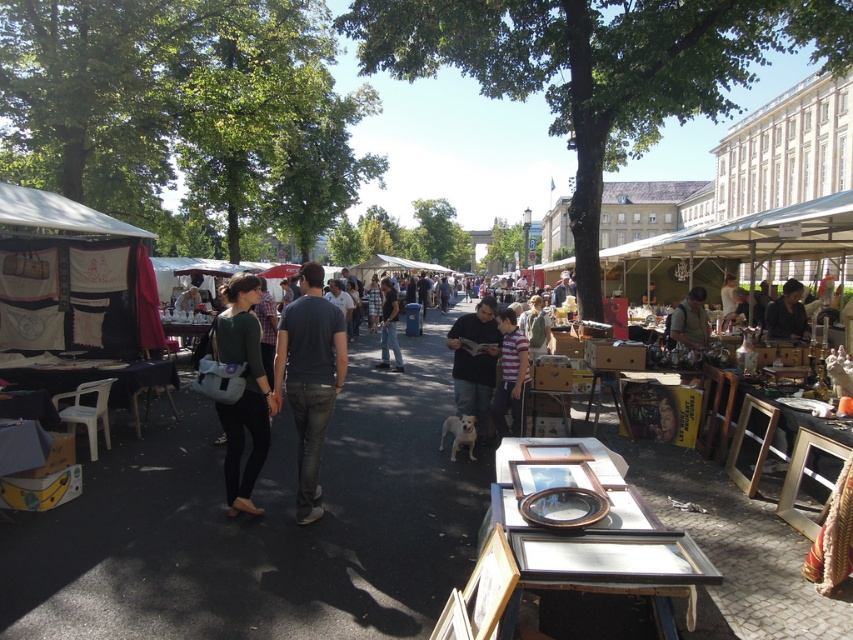
Does dark gray cotton t-shirt at center have a lesser height compared to dark brown leather jacket at center?

Incorrect, dark gray cotton t-shirt at center's height does not fall short of dark brown leather jacket at center's.

Which is in front, point (300, 435) or point (793, 333)?

Point (300, 435) is more forward.

What are the coordinates of `dark gray cotton t-shirt at center` in the screenshot? It's located at (309, 378).

Where is `dark gray cotton t-shirt at center`? Image resolution: width=853 pixels, height=640 pixels. dark gray cotton t-shirt at center is located at coordinates (309, 378).

Consider the image. Which is more to the left, dark brown leather jacket at center or matte brown leather jacket at center?

From the viewer's perspective, matte brown leather jacket at center appears more on the left side.

This screenshot has width=853, height=640. What do you see at coordinates (786, 314) in the screenshot?
I see `dark brown leather jacket at center` at bounding box center [786, 314].

The width and height of the screenshot is (853, 640). In order to click on dark brown leather jacket at center in this screenshot , I will do `click(786, 314)`.

Is matte brown leather jacket at center shorter than dark blue jeans at center?

Correct, matte brown leather jacket at center is not as tall as dark blue jeans at center.

Can you confirm if matte brown leather jacket at center is wider than dark blue jeans at center?

Correct, the width of matte brown leather jacket at center exceeds that of dark blue jeans at center.

Does point (672, 332) lie in front of point (399, 358)?

Yes, it is.

The width and height of the screenshot is (853, 640). What are the coordinates of `matte brown leather jacket at center` in the screenshot? It's located at (689, 320).